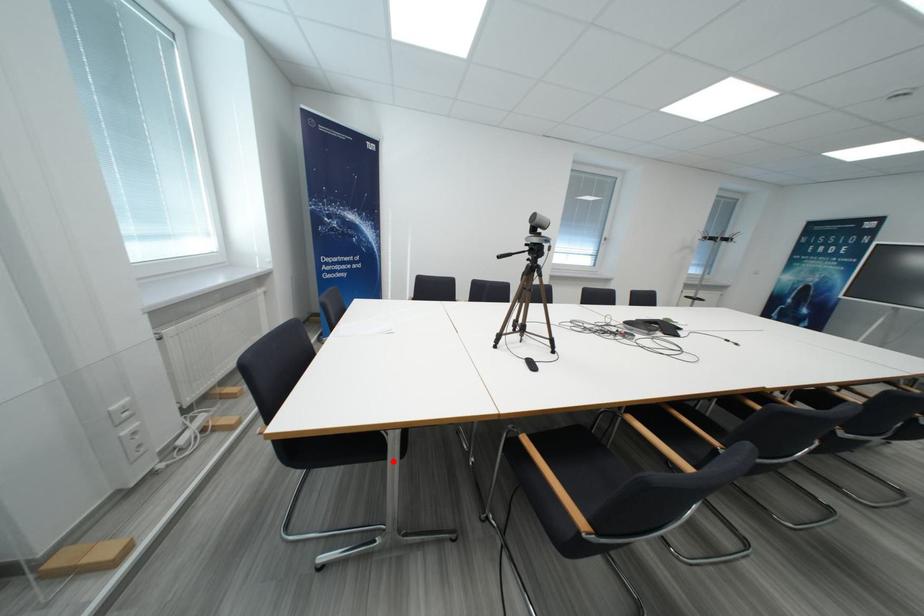
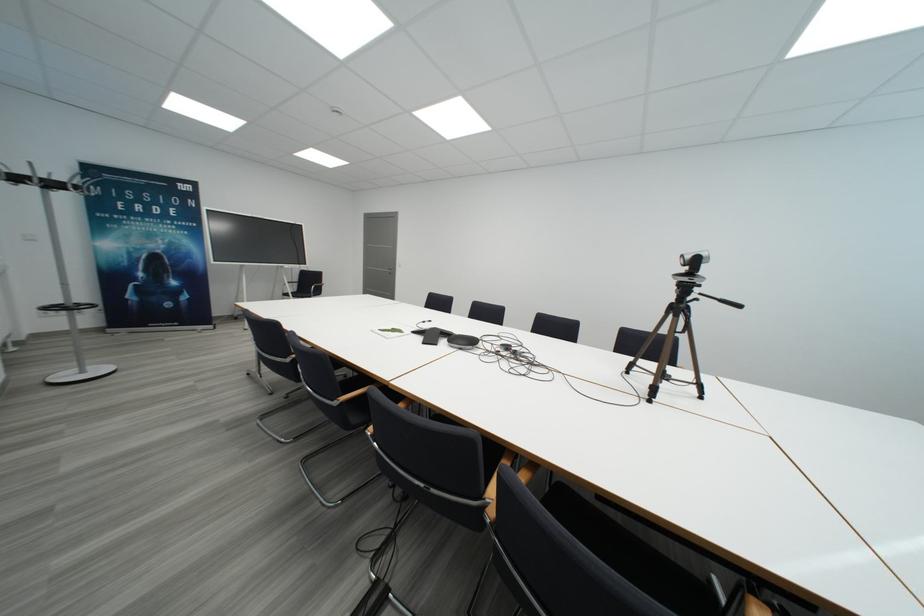
Question: I am providing you with two images of the same scene from different viewpoints. A red point is marked on the first image. Can you still see the location of the red point in image 2?

Choices:
 (A) Yes
 (B) No

Answer: (B)